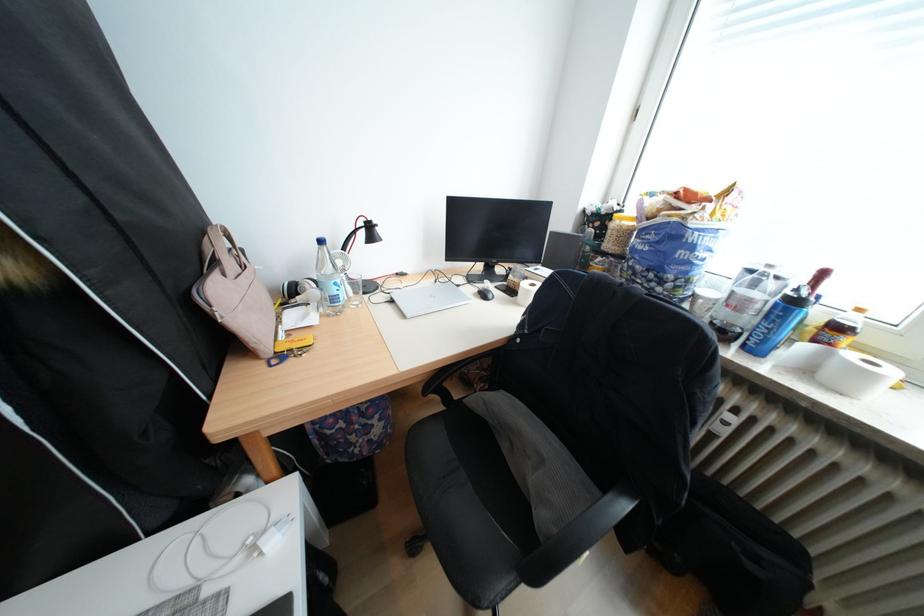
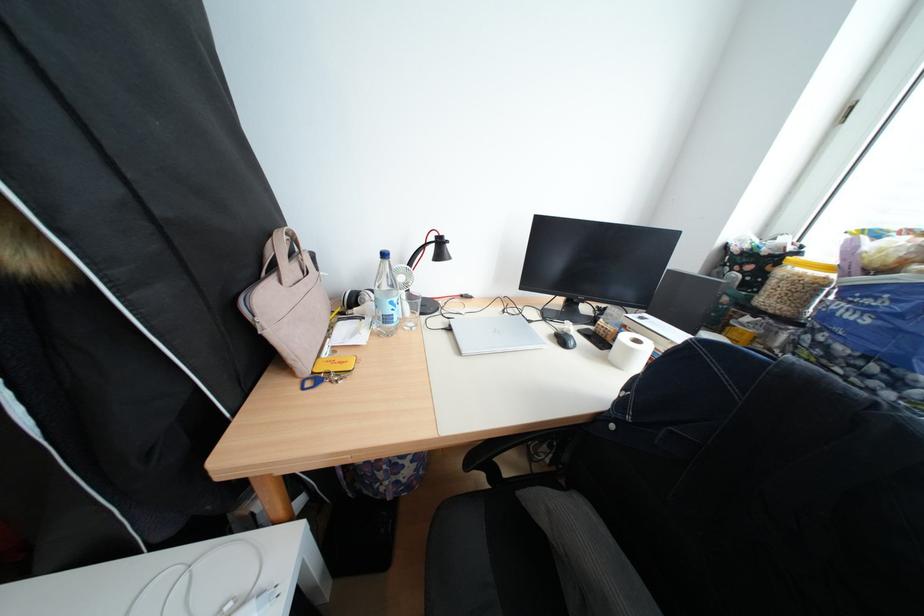
Question: The camera is either moving clockwise (left) or counter-clockwise (right) around the object. The first image is from the beginning of the video and the second image is from the end. Is the camera moving left or right when shooting the video?

Choices:
 (A) Left
 (B) Right

Answer: (B)